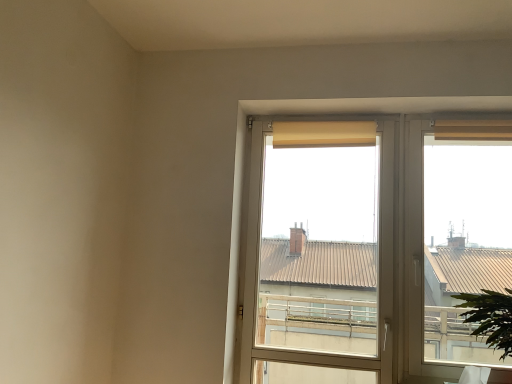
Question: Is beige fabric curtain at upper right, acting as the 2th curtain starting from the left, to the left of matte glass window at center from the viewer's perspective?

Choices:
 (A) no
 (B) yes

Answer: (A)

Question: Does beige fabric curtain at upper right, acting as the 2th curtain starting from the left, have a lesser width compared to matte glass window at center?

Choices:
 (A) yes
 (B) no

Answer: (A)

Question: From the image's perspective, does beige fabric curtain at upper right, the first curtain positioned from the right, appear lower than matte glass window at center?

Choices:
 (A) yes
 (B) no

Answer: (B)

Question: Can you confirm if beige fabric curtain at upper right, acting as the 2th curtain starting from the left, is wider than matte glass window at center?

Choices:
 (A) yes
 (B) no

Answer: (B)

Question: Is matte glass window at center at the back of beige fabric curtain at upper right, the first curtain positioned from the right?

Choices:
 (A) no
 (B) yes

Answer: (A)

Question: Does beige fabric curtain at upper right, the first curtain positioned from the right, have a lesser height compared to matte glass window at center?

Choices:
 (A) yes
 (B) no

Answer: (A)

Question: Is beige fabric curtain at upper right, the first curtain positioned from the right, located outside beige fabric curtain at upper center, the first curtain from the left?

Choices:
 (A) no
 (B) yes

Answer: (B)

Question: Can you confirm if beige fabric curtain at upper right, the first curtain positioned from the right, is thinner than beige fabric curtain at upper center, the first curtain from the left?

Choices:
 (A) yes
 (B) no

Answer: (B)

Question: Is the depth of beige fabric curtain at upper right, acting as the 2th curtain starting from the left, less than that of beige fabric curtain at upper center, the second curtain positioned from the right?

Choices:
 (A) yes
 (B) no

Answer: (A)

Question: From a real-world perspective, is beige fabric curtain at upper right, acting as the 2th curtain starting from the left, below beige fabric curtain at upper center, the second curtain positioned from the right?

Choices:
 (A) yes
 (B) no

Answer: (B)

Question: From the image's perspective, would you say beige fabric curtain at upper right, acting as the 2th curtain starting from the left, is shown under beige fabric curtain at upper center, the first curtain from the left?

Choices:
 (A) no
 (B) yes

Answer: (A)

Question: Considering the relative positions of beige fabric curtain at upper right, the first curtain positioned from the right, and beige fabric curtain at upper center, the first curtain from the left, in the image provided, is beige fabric curtain at upper right, the first curtain positioned from the right, to the left of beige fabric curtain at upper center, the first curtain from the left, from the viewer's perspective?

Choices:
 (A) yes
 (B) no

Answer: (B)

Question: Is green leafy plant at lower right oriented towards beige fabric curtain at upper right, acting as the 2th curtain starting from the left?

Choices:
 (A) no
 (B) yes

Answer: (A)